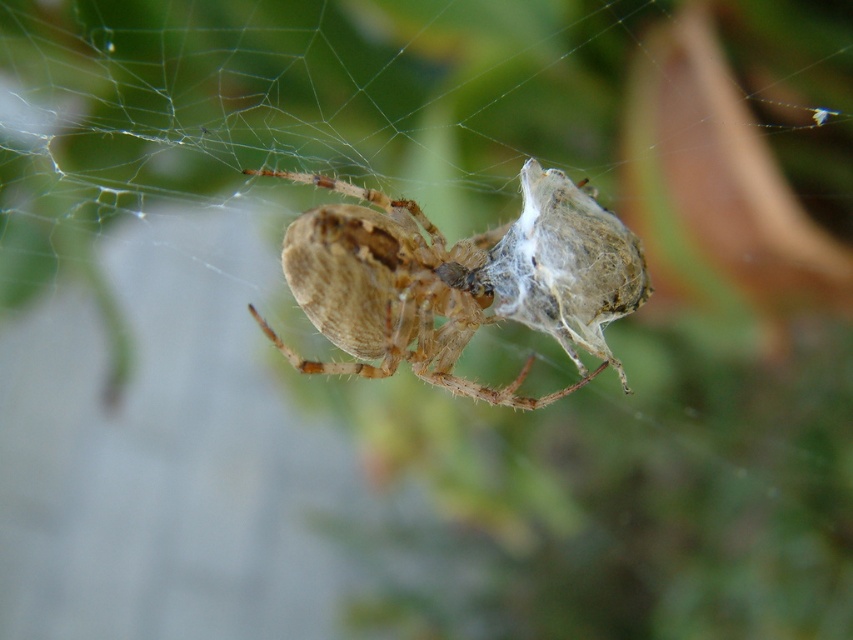
Who is positioned more to the left, translucent silk web at center or brown fuzzy spider at center?

translucent silk web at center is more to the left.

Where is `translucent silk web at center`? translucent silk web at center is located at coordinates (286, 100).

Where is `translucent silk web at center`? Image resolution: width=853 pixels, height=640 pixels. translucent silk web at center is located at coordinates (286, 100).

The image size is (853, 640). Identify the location of translucent silk web at center. (286, 100).